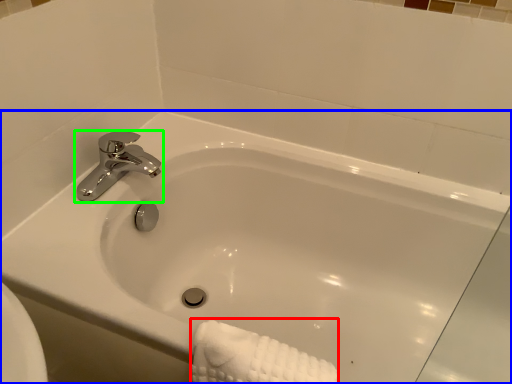
Question: Which is nearer to the bath towel (highlighted by a red box)? bathtub (highlighted by a blue box) or tap (highlighted by a green box).

Choices:
 (A) bathtub
 (B) tap

Answer: (A)